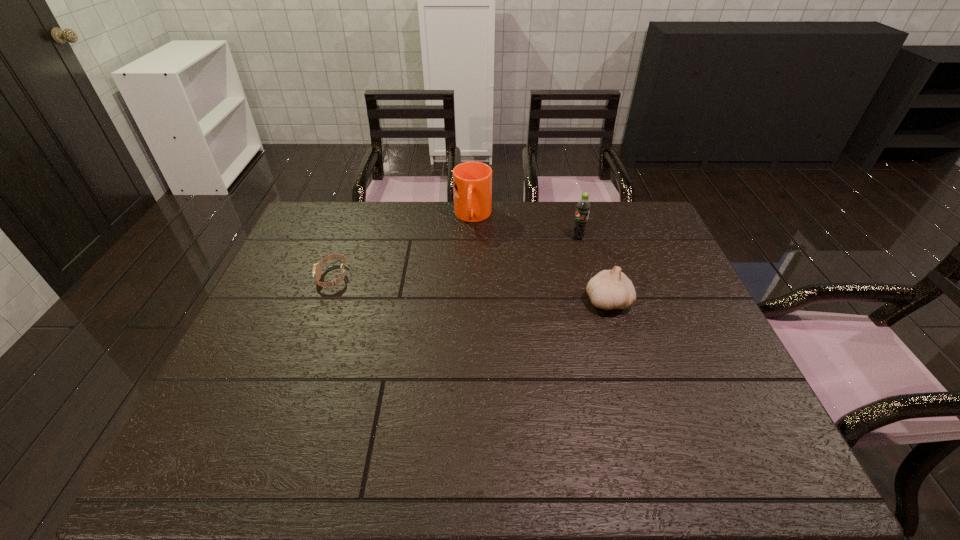
The width and height of the screenshot is (960, 540). I want to click on the leftmost object, so click(x=316, y=271).

The image size is (960, 540). What are the coordinates of `the shortest object` in the screenshot? It's located at (316, 271).

Identify the location of the second shortest object. This screenshot has height=540, width=960. (610, 289).

This screenshot has width=960, height=540. Find the location of `the second farthest object`. the second farthest object is located at coordinates (583, 207).

The width and height of the screenshot is (960, 540). I want to click on mug, so click(472, 181).

This screenshot has height=540, width=960. I want to click on the farthest object, so click(x=472, y=181).

In order to click on vacant space situated 0.100m on the face of the leftmost object in this screenshot , I will do pyautogui.click(x=284, y=276).

Where is `vacant area located 0.210m on the left of the second shortest object`? The height and width of the screenshot is (540, 960). vacant area located 0.210m on the left of the second shortest object is located at coordinates (509, 301).

Identify the location of free space located on the front label of the third nearest object. (518, 259).

Where is `free spot located on the front label of the third nearest object`? The height and width of the screenshot is (540, 960). free spot located on the front label of the third nearest object is located at coordinates (561, 244).